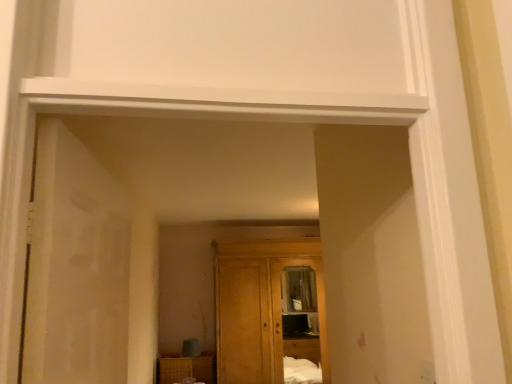
Question: Looking at their shapes, would you say white matte door at left is wider or thinner than wooden wardrobe at center?

Choices:
 (A) thin
 (B) wide

Answer: (A)

Question: Does point (36, 165) appear closer or farther from the camera than point (279, 271)?

Choices:
 (A) closer
 (B) farther

Answer: (A)

Question: Which is nearer to the woven wood cabinet at lower center?

Choices:
 (A) white matte door at left
 (B) wooden wardrobe at center

Answer: (B)

Question: Considering the real-world distances, which object is closest to the wooden wardrobe at center?

Choices:
 (A) woven wood cabinet at lower center
 (B) white matte door at left

Answer: (A)